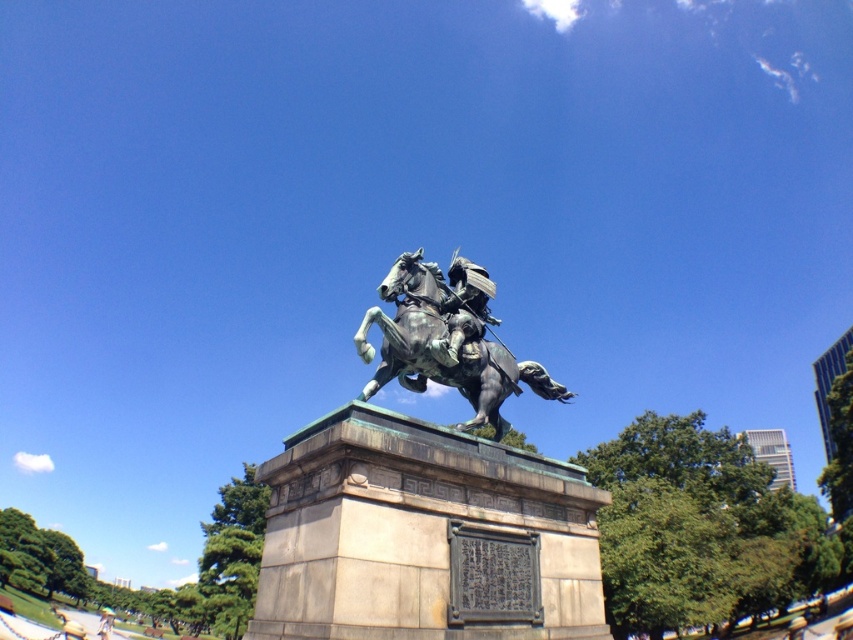
Looking at this image, which is above, green patina statue at center or bronze statue at center?

bronze statue at center

Does point (553, 387) come behind point (404, 301)?

Yes, point (553, 387) is behind point (404, 301).

Between point (604, 497) and point (444, 292), which one is positioned behind?

The point (444, 292) is more distant.

Find the location of a particular element. green patina statue at center is located at coordinates point(426,508).